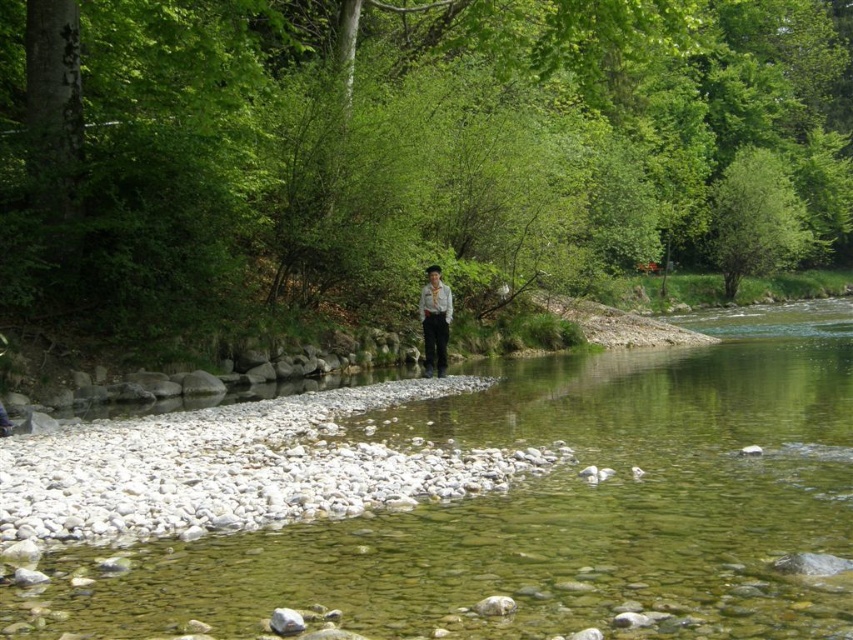
You are a hiker who wants to cross the river. You see the clear water at center and the light brown fabric shirt at center. Which one is wider in size?

The clear water at center has a larger size compared to the light brown fabric shirt at center, so the clear water at center is wider.